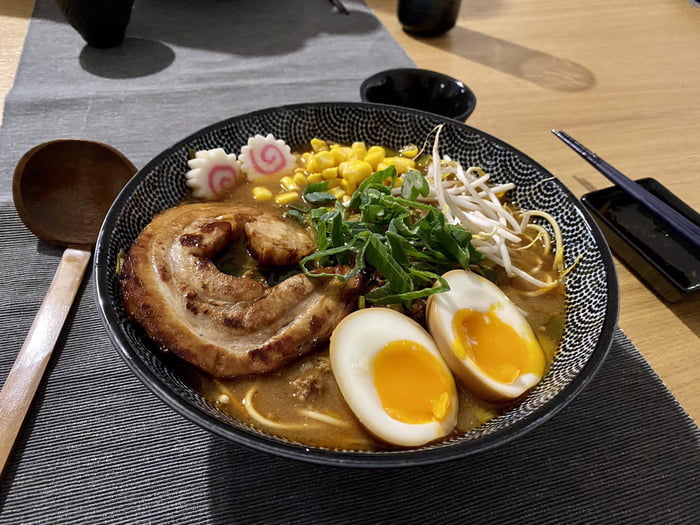
Image resolution: width=700 pixels, height=525 pixels. I want to click on black cup, so click(414, 27).